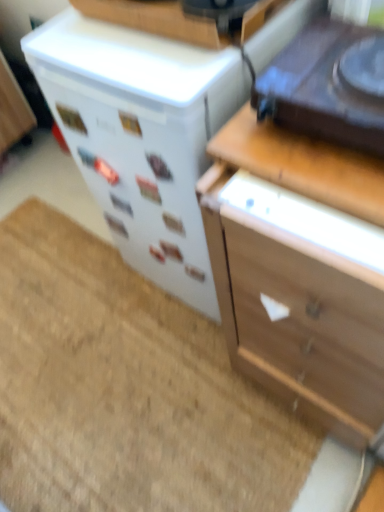
Question: Is white glossy refrigerator at center-left, which ranks as the first appliance in back-to-front order, facing towards wooden at upper right?

Choices:
 (A) yes
 (B) no

Answer: (B)

Question: Are white glossy refrigerator at center-left, which ranks as the first appliance in back-to-front order, and wooden at upper right far apart?

Choices:
 (A) no
 (B) yes

Answer: (A)

Question: Is white glossy refrigerator at center-left, which ranks as the first appliance in back-to-front order, taller than wooden at upper right?

Choices:
 (A) yes
 (B) no

Answer: (A)

Question: Can we say white glossy refrigerator at center-left, which is the 2th appliance from front to back, lies outside wooden at upper right?

Choices:
 (A) no
 (B) yes

Answer: (B)

Question: Can you confirm if white glossy refrigerator at center-left, which is the 2th appliance from front to back, is shorter than wooden at upper right?

Choices:
 (A) no
 (B) yes

Answer: (A)

Question: Considering the positions of wooden chest of drawers at right and beige carpet at lower left in the image, is wooden chest of drawers at right bigger or smaller than beige carpet at lower left?

Choices:
 (A) big
 (B) small

Answer: (A)

Question: Do you think wooden chest of drawers at right is within beige carpet at lower left, or outside of it?

Choices:
 (A) outside
 (B) inside

Answer: (A)

Question: Would you say wooden chest of drawers at right is to the left or to the right of beige carpet at lower left in the picture?

Choices:
 (A) left
 (B) right

Answer: (B)

Question: Is wooden chest of drawers at right in front of or behind beige carpet at lower left in the image?

Choices:
 (A) behind
 (B) front

Answer: (B)

Question: Would you say white glossy refrigerator at center-left, which ranks as the first appliance in back-to-front order, is inside or outside beige carpet at lower left?

Choices:
 (A) inside
 (B) outside

Answer: (B)

Question: Is white glossy refrigerator at center-left, which ranks as the first appliance in back-to-front order, wider or thinner than beige carpet at lower left?

Choices:
 (A) wide
 (B) thin

Answer: (B)

Question: Is white glossy refrigerator at center-left, which ranks as the first appliance in back-to-front order, to the left or to the right of beige carpet at lower left in the image?

Choices:
 (A) right
 (B) left

Answer: (A)

Question: From the image's perspective, is white glossy refrigerator at center-left, which is the 2th appliance from front to back, above or below beige carpet at lower left?

Choices:
 (A) below
 (B) above

Answer: (B)

Question: Is shiny black turntable at upper right, which is the 2th appliance from back to front, taller or shorter than wooden at upper right?

Choices:
 (A) tall
 (B) short

Answer: (A)

Question: In terms of size, does shiny black turntable at upper right, which is the 2th appliance from back to front, appear bigger or smaller than wooden at upper right?

Choices:
 (A) small
 (B) big

Answer: (B)